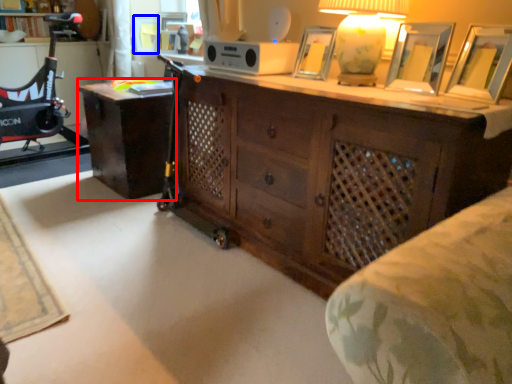
Question: Which of the following is the closest to the observer, desk (highlighted by a red box) or picture frame (highlighted by a blue box)?

Choices:
 (A) desk
 (B) picture frame

Answer: (A)